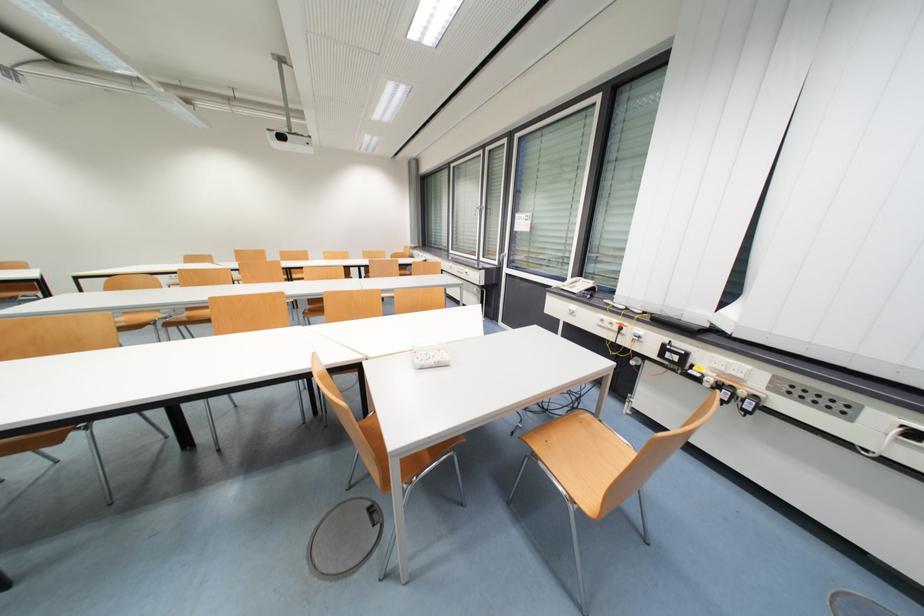
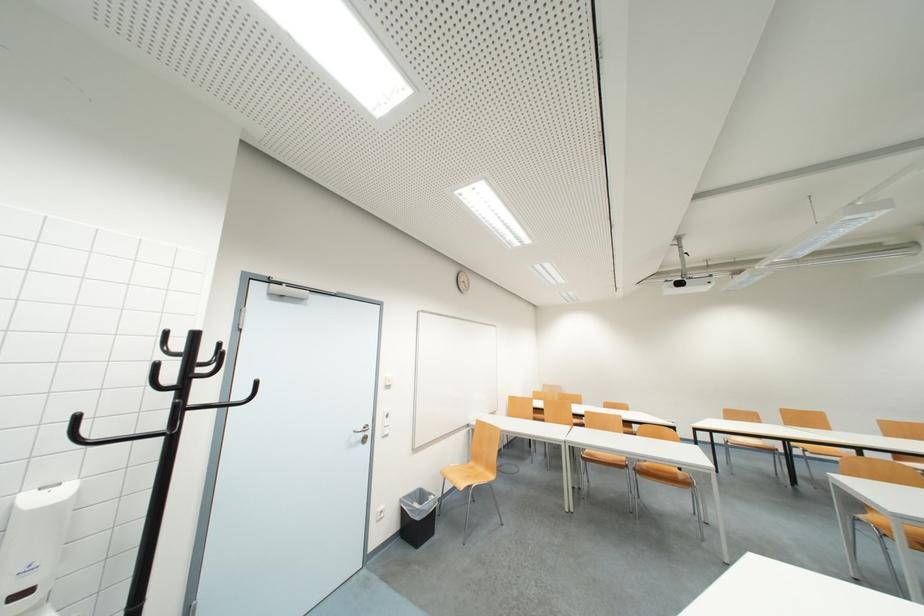
Question: I am providing you with two images of the same scene from different viewpoints. After the viewpoint changes to image2, which objects are now occluded?

Choices:
 (A) silver door handle
 (B) black coat rack hook
 (C) white light switch
 (D) none of these

Answer: (D)